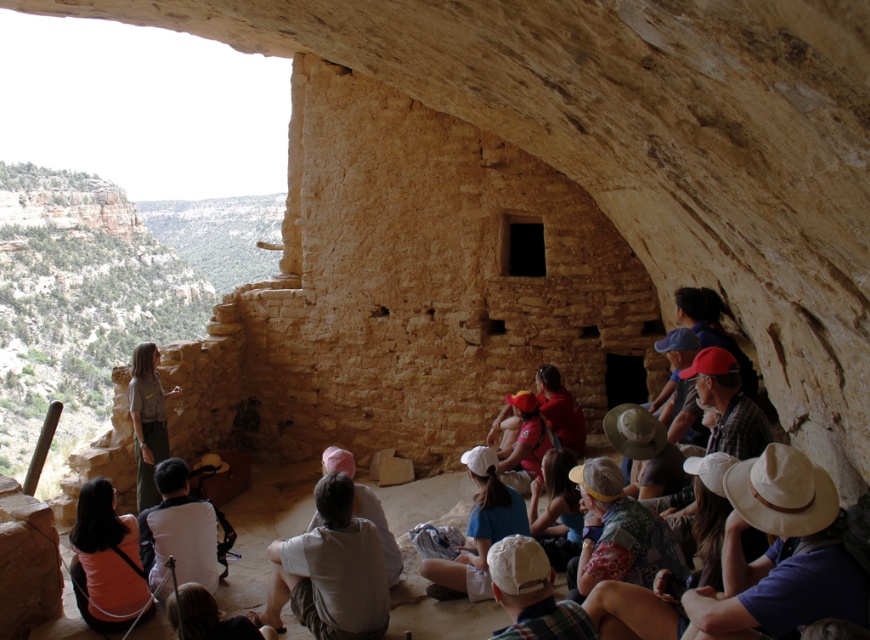
Question: Can you confirm if khaki uniform at center is positioned to the right of light brown fabric at lower center?

Choices:
 (A) yes
 (B) no

Answer: (B)

Question: Which object is closer to the camera taking this photo?

Choices:
 (A) white cotton shirt at lower center
 (B) pink fabric hat at center

Answer: (A)

Question: Is white cotton shirt at center in front of white cotton shirt at lower center?

Choices:
 (A) no
 (B) yes

Answer: (B)

Question: Which point appears closest to the camera in this image?

Choices:
 (A) (527, 244)
 (B) (99, 602)
 (C) (382, 548)

Answer: (B)

Question: Which object is farther from the camera taking this photo?

Choices:
 (A) khaki uniform at center
 (B) white fabric cap at center
 (C) orange cotton shirt at lower left
 (D) white cotton shirt at center

Answer: (A)

Question: Does white woven hat at lower right have a greater width compared to white cotton shirt at lower center?

Choices:
 (A) no
 (B) yes

Answer: (B)